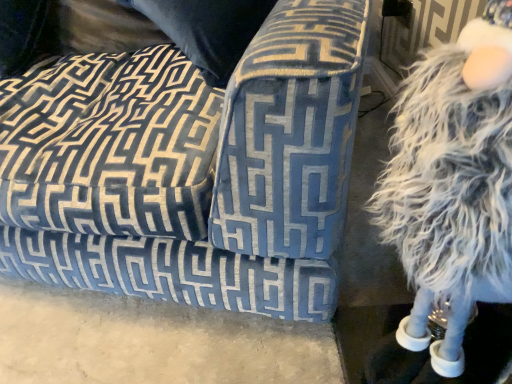
Question: Choose the correct answer: Is white fluffy figurine at right inside velvet blue couch at center or outside it?

Choices:
 (A) inside
 (B) outside

Answer: (B)

Question: From the image's perspective, is white fluffy figurine at right positioned above or below velvet blue couch at center?

Choices:
 (A) above
 (B) below

Answer: (B)

Question: Is white fluffy figurine at right taller or shorter than velvet blue couch at center?

Choices:
 (A) tall
 (B) short

Answer: (A)

Question: Considering the positions of velvet blue couch at center and white fluffy figurine at right in the image, is velvet blue couch at center wider or thinner than white fluffy figurine at right?

Choices:
 (A) wide
 (B) thin

Answer: (A)

Question: Is velvet blue couch at center inside the boundaries of white fluffy figurine at right, or outside?

Choices:
 (A) inside
 (B) outside

Answer: (B)

Question: In the image, is velvet blue couch at center positioned in front of or behind white fluffy figurine at right?

Choices:
 (A) front
 (B) behind

Answer: (B)

Question: From a real-world perspective, is velvet blue couch at center physically located above or below white fluffy figurine at right?

Choices:
 (A) below
 (B) above

Answer: (A)